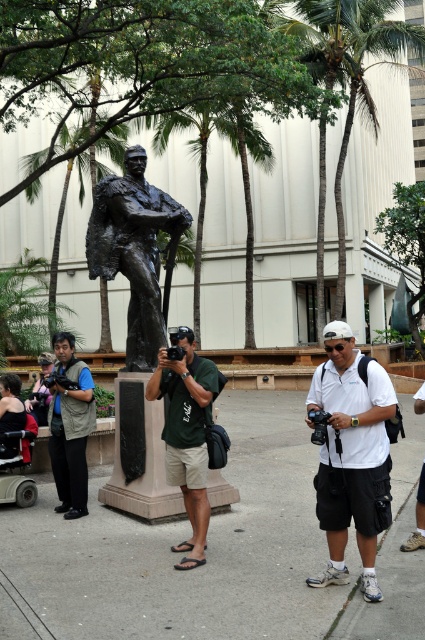
Does point (393, 406) come farther from viewer compared to point (176, 372)?

No, it is in front of (176, 372).

How much distance is there between white matte shirt at center and green fabric shirt at center?

The distance of white matte shirt at center from green fabric shirt at center is 3.98 feet.

Where is `white matte shirt at center`? white matte shirt at center is located at coordinates (351, 454).

Locate an element on the screen. Image resolution: width=425 pixels, height=640 pixels. white matte shirt at center is located at coordinates (351, 454).

Locate an element on the screen. This screenshot has height=640, width=425. matte black vest at center is located at coordinates (70, 428).

Describe the element at coordinates (70, 428) in the screenshot. I see `matte black vest at center` at that location.

Where is `matte black vest at center`? matte black vest at center is located at coordinates (70, 428).

Does green fabric shirt at center appear under matte black vest at center?

No, green fabric shirt at center is not below matte black vest at center.

Which of these two, green fabric shirt at center or matte black vest at center, stands taller?

With more height is matte black vest at center.

You are a GUI agent. You are given a task and a screenshot of the screen. Output one action in this format:
    pyautogui.click(x=<x>, y=<y>)
    Task: Click on the green fabric shirt at center
    This screenshot has width=425, height=640.
    Given the screenshot: What is the action you would take?
    pyautogui.click(x=187, y=433)